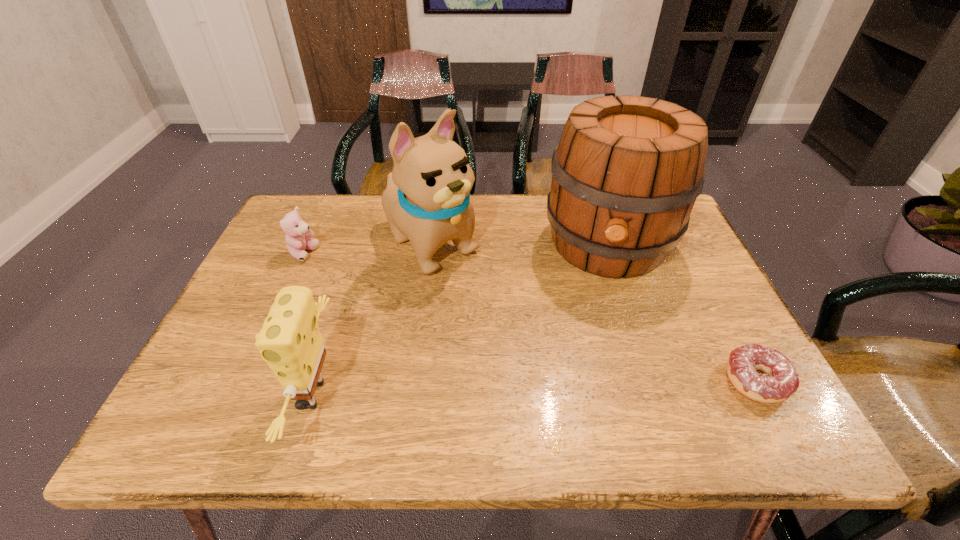
You are a GUI agent. You are given a task and a screenshot of the screen. Output one action in this format:
    pyautogui.click(x=<x>, y=<y>)
    Task: Click on the empty space between the teddy bear and the cider
    
    Given the screenshot: What is the action you would take?
    pyautogui.click(x=456, y=249)

Find the location of a particular element. Image resolution: width=960 pixels, height=540 pixels. vacant space that's between the cider and the third tallest object is located at coordinates (459, 320).

Identify which object is the second closest to the cider. Please provide its 2D coordinates. Your answer should be formatted as a tuple, i.e. [(x, y)], where the tuple contains the x and y coordinates of a point satisfying the conditions above.

[(781, 380)]

Locate an element on the screen. This screenshot has width=960, height=540. object identified as the third closest to the sponge is located at coordinates (626, 173).

Where is `free space that satisfies the following two spatial constraints: 1. on the back side of the cider; 2. on the right side of the third object from right to left`? The image size is (960, 540). free space that satisfies the following two spatial constraints: 1. on the back side of the cider; 2. on the right side of the third object from right to left is located at coordinates (431, 244).

The width and height of the screenshot is (960, 540). What are the coordinates of `free space that satisfies the following two spatial constraints: 1. on the back side of the second shortest object; 2. on the right side of the third object from left to right` in the screenshot? It's located at (308, 245).

Identify the location of free spot that satisfies the following two spatial constraints: 1. on the front side of the doughnut; 2. on the right side of the cider. (655, 381).